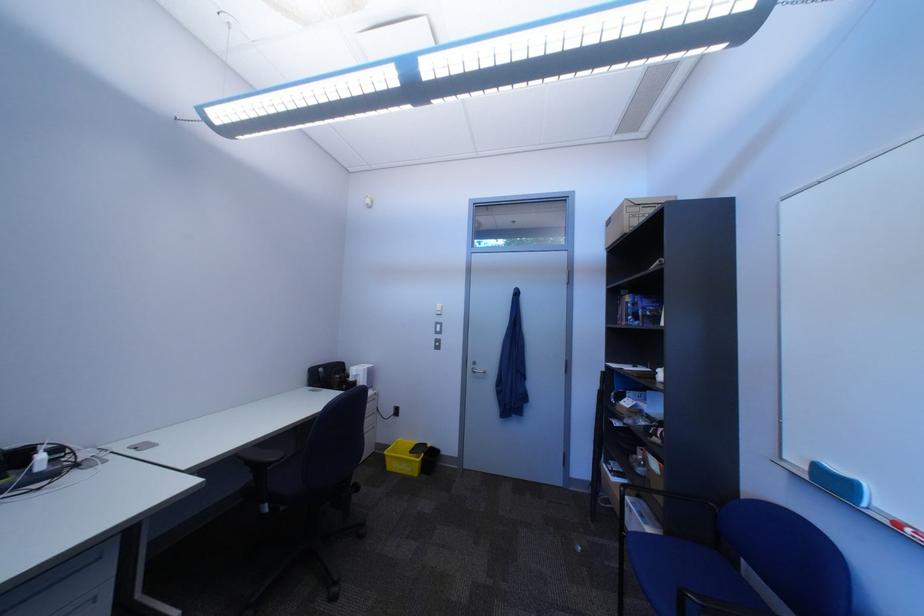
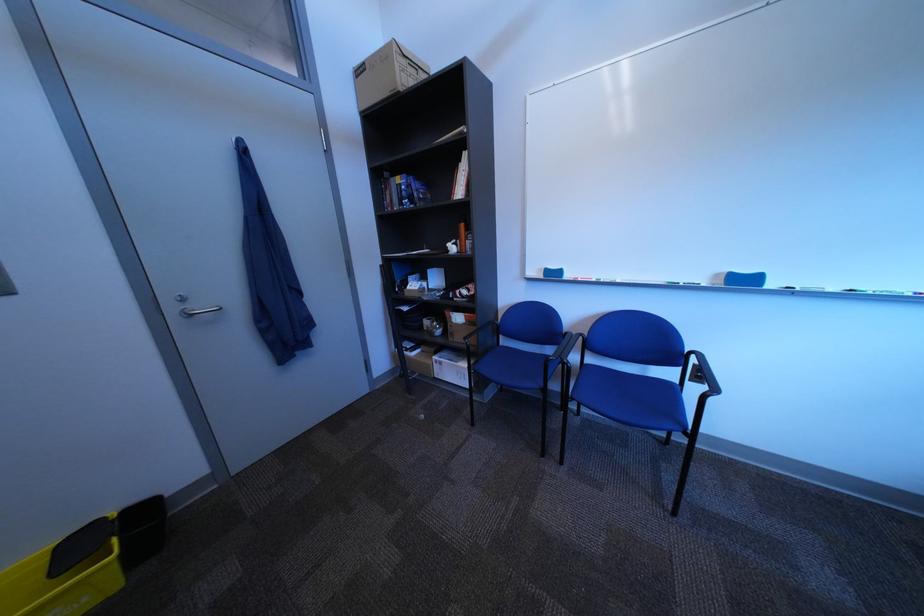
The images are taken continuously from a first-person perspective. In which direction is your viewpoint rotating?

The camera's rotation is toward right-down.